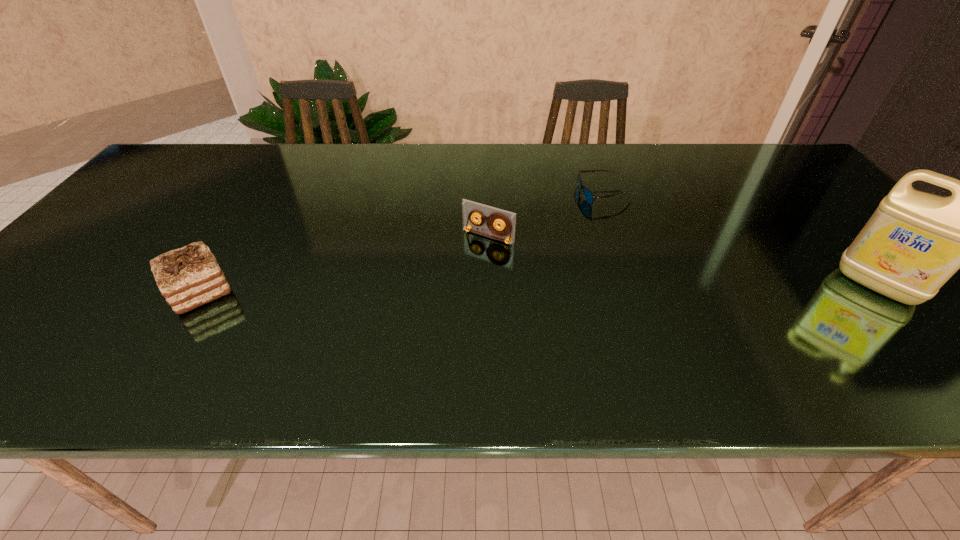
Identify the location of vacant space located 0.170m at the front of the third object from left to right showing the lenses. The width and height of the screenshot is (960, 540). (552, 233).

I want to click on vacant space situated at the front of the third object from left to right showing the lenses, so click(x=499, y=271).

The width and height of the screenshot is (960, 540). Identify the location of vacant space located 0.340m at the front of the videotape with visible reels. coord(401,343).

The height and width of the screenshot is (540, 960). I want to click on vacant area situated at the front of the videotape with visible reels, so click(406, 336).

The width and height of the screenshot is (960, 540). In order to click on free space located 0.310m at the front of the videotape with visible reels in this screenshot , I will do `click(409, 333)`.

I want to click on object positioned at the far edge, so click(x=588, y=195).

Where is `chocolate cake that is at the near edge`? chocolate cake that is at the near edge is located at coordinates (188, 277).

You are a GUI agent. You are given a task and a screenshot of the screen. Output one action in this format:
    pyautogui.click(x=<x>, y=<y>)
    Task: Click on the detergent present at the near edge
    
    Given the screenshot: What is the action you would take?
    pyautogui.click(x=915, y=241)

Image resolution: width=960 pixels, height=540 pixels. What are the coordinates of `object positioned at the right edge` in the screenshot? It's located at (915, 241).

The width and height of the screenshot is (960, 540). I want to click on object that is at the near right corner, so click(x=915, y=241).